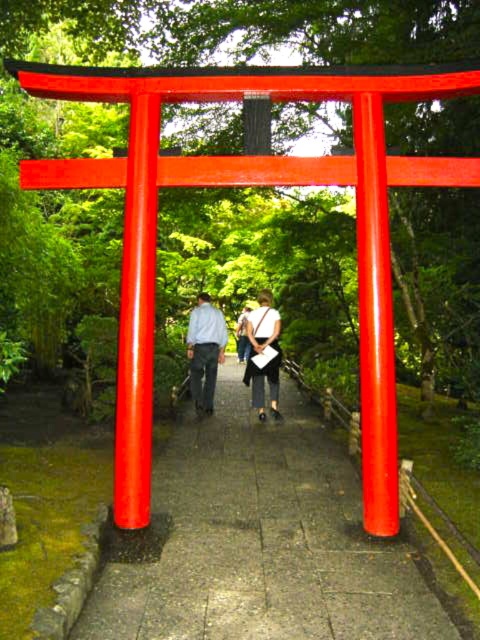
You are a photographer standing at the entrance of the torii gate. You notice a light blue shirt at center and a matte white bag at center. Which object is closer to the camera?

The light blue shirt at center is shorter than the matte white bag at center, so the light blue shirt at center is closer to the camera.